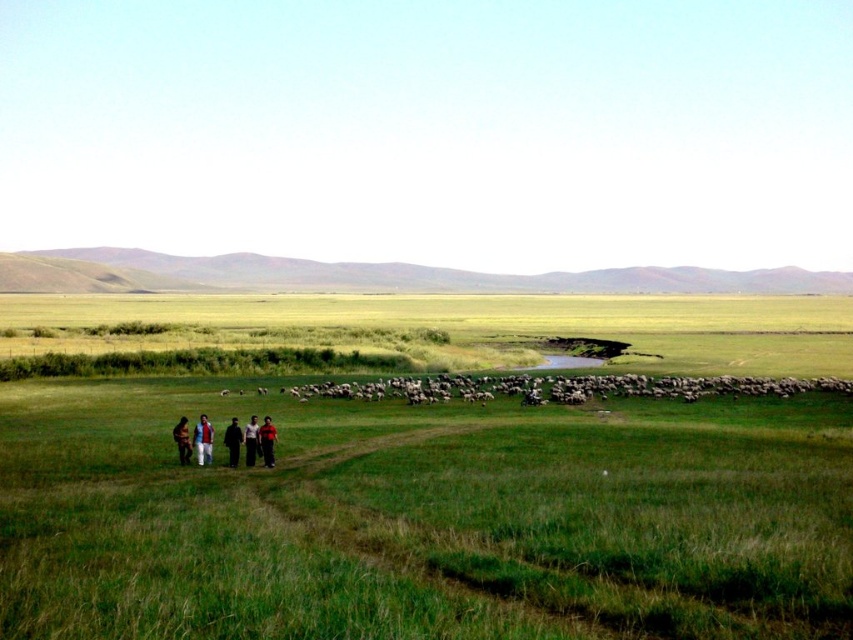
Question: Can you confirm if dark brown leather jacket at lower center is positioned to the right of black fabric person at lower center?

Choices:
 (A) yes
 (B) no

Answer: (A)

Question: Which object appears closest to the camera in this image?

Choices:
 (A) green grassy field at center
 (B) dark gray fabric pants at lower center

Answer: (A)

Question: Which object appears closest to the camera in this image?

Choices:
 (A) black fabric person at lower center
 (B) green grassy field at center

Answer: (B)

Question: Does green grassy field at center have a lesser width compared to black fabric person at lower center?

Choices:
 (A) no
 (B) yes

Answer: (A)

Question: Is dark brown leather jacket at lower center positioned in front of dark brown leather jacket at lower left?

Choices:
 (A) no
 (B) yes

Answer: (A)

Question: Which is nearer to the light brown fabric jacket at lower left?

Choices:
 (A) dark brown leather jacket at lower center
 (B) dark brown leather jacket at lower left

Answer: (B)